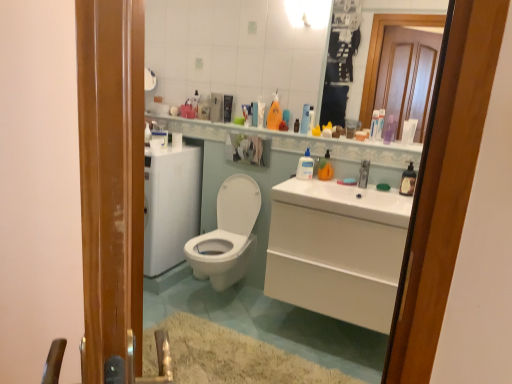
Identify the location of free space to the left of white glossy sink at upper center, arranged as the 2th sink when viewed from the left. The image size is (512, 384). (335, 184).